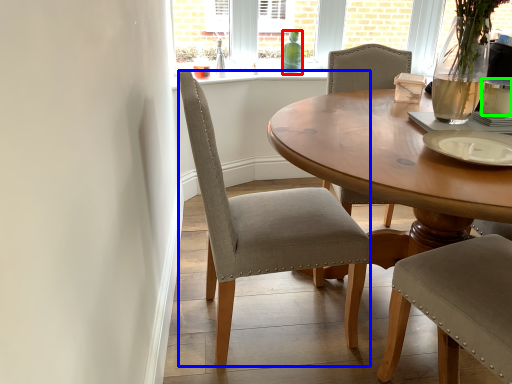
Question: Which is farther away from bottle (highlighted by a red box)? chair (highlighted by a blue box) or coffee cup (highlighted by a green box)?

Choices:
 (A) chair
 (B) coffee cup

Answer: (A)